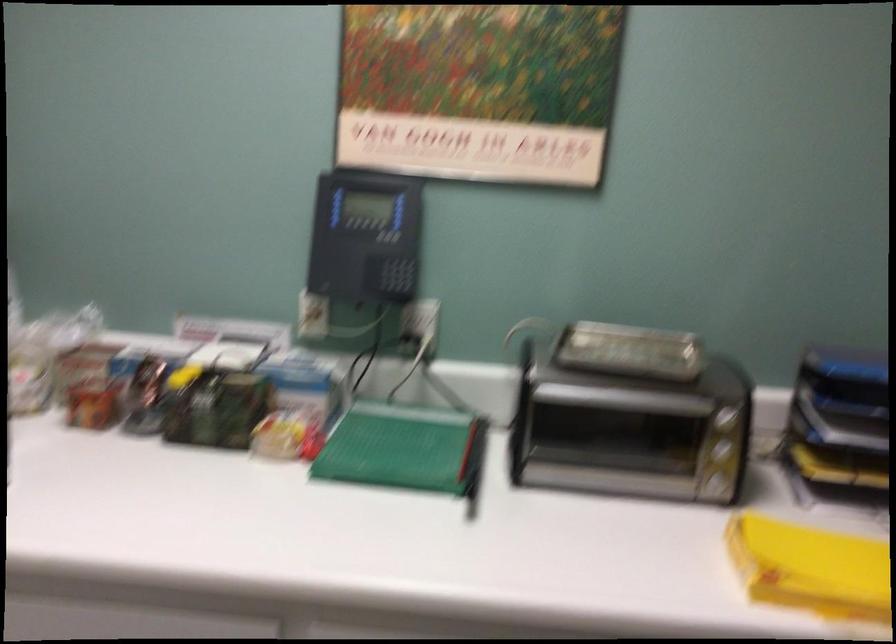
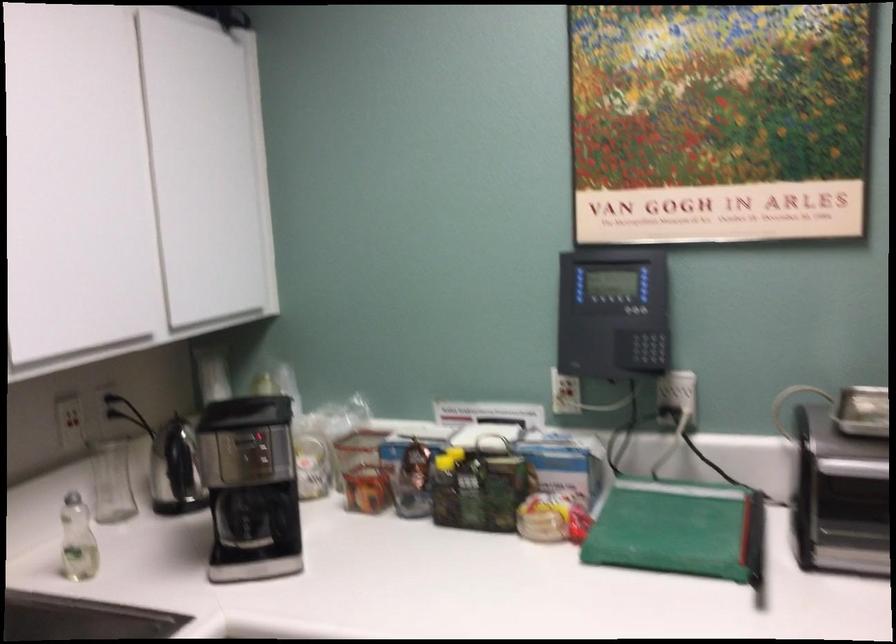
Where in the second image is the point corresponding to point 389,276 from the first image?

(642, 348)